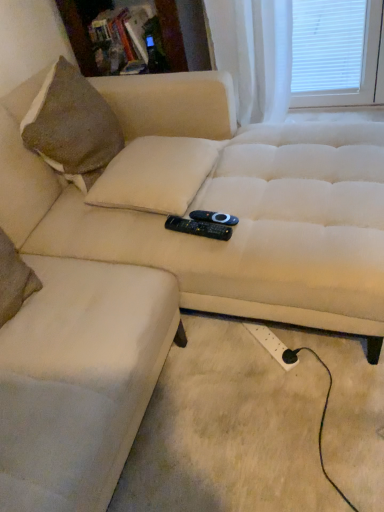
Locate an element on the screen. The height and width of the screenshot is (512, 384). vacant space to the left of white plastic extension cord at lower right is located at coordinates (227, 358).